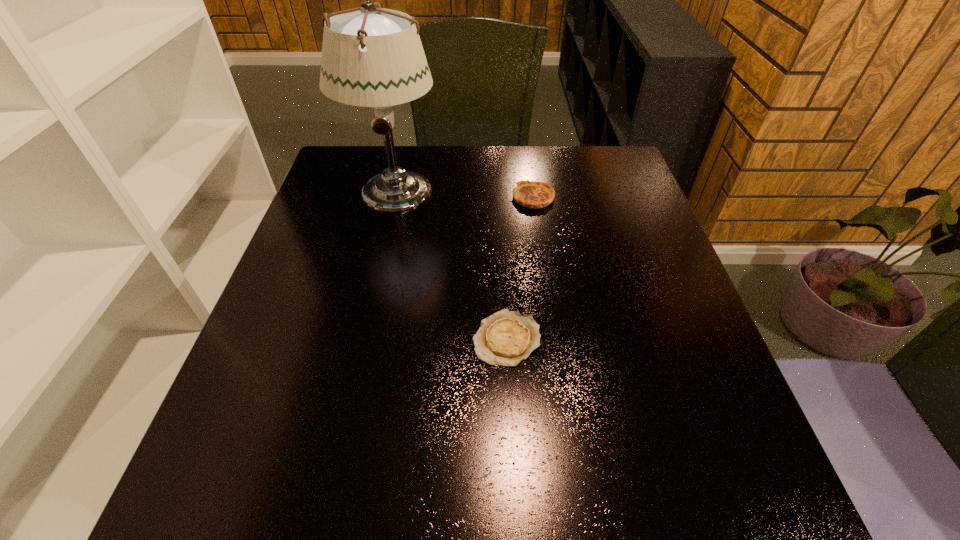
You are a GUI agent. You are given a task and a screenshot of the screen. Output one action in this format:
    pyautogui.click(x=<x>, y=<y>)
    Task: Click on the tallest object
    This screenshot has width=960, height=540.
    Given the screenshot: What is the action you would take?
    pyautogui.click(x=372, y=57)

Where is `the leftmost object`? the leftmost object is located at coordinates (372, 57).

You are a GUI agent. You are given a task and a screenshot of the screen. Output one action in this format:
    pyautogui.click(x=<x>, y=<y>)
    Task: Click on the second tallest object
    
    Given the screenshot: What is the action you would take?
    pyautogui.click(x=532, y=194)

Identify the location of the taller quiche. Image resolution: width=960 pixels, height=540 pixels. (532, 194).

Where is `the shortest object`? the shortest object is located at coordinates (506, 338).

The image size is (960, 540). Find the location of `the nearest object`. the nearest object is located at coordinates (506, 338).

Image resolution: width=960 pixels, height=540 pixels. Identify the location of free location located on the lampshade of the tallest object. (360, 343).

The height and width of the screenshot is (540, 960). Identify the location of vacant space positioned 0.180m on the left of the farther quiche. (444, 198).

You are a GUI agent. You are given a task and a screenshot of the screen. Output one action in this format:
    pyautogui.click(x=<x>, y=<y>)
    Task: Click on the vacant area situated 0.200m on the front of the shortest object
    The height and width of the screenshot is (540, 960).
    Given the screenshot: What is the action you would take?
    pyautogui.click(x=514, y=483)

Where is `lampshade situated at the far edge`? lampshade situated at the far edge is located at coordinates (372, 57).